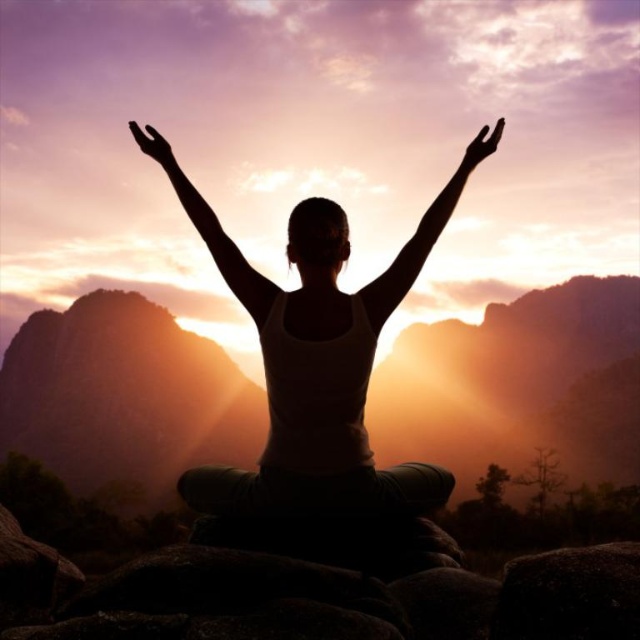
Is matte brown rock at center wider than silhouette yoga pose at center?

Yes.

Does matte brown rock at center have a lesser width compared to silhouette yoga pose at center?

No, matte brown rock at center is not thinner than silhouette yoga pose at center.

Where is `matte brown rock at center`? This screenshot has height=640, width=640. matte brown rock at center is located at coordinates (515, 385).

Is silhouette yoga pose at center behind silhouette arm at center?

No, it is in front of silhouette arm at center.

Is silhouette yoga pose at center above silhouette arm at center?

Actually, silhouette yoga pose at center is below silhouette arm at center.

Who is more forward, (248,516) or (179,170)?

Positioned in front is point (248,516).

Where is `silhouette yoga pose at center`? Image resolution: width=640 pixels, height=640 pixels. silhouette yoga pose at center is located at coordinates click(x=316, y=371).

Does silhouette yoga pose at center have a greater width compared to transparent glass hand at upper left?

Indeed, silhouette yoga pose at center has a greater width compared to transparent glass hand at upper left.

Between silhouette yoga pose at center and transparent glass hand at upper left, which one appears on the right side from the viewer's perspective?

From the viewer's perspective, silhouette yoga pose at center appears more on the right side.

This screenshot has width=640, height=640. I want to click on silhouette yoga pose at center, so click(x=316, y=371).

Locate an element on the screen. silhouette yoga pose at center is located at coordinates (316, 371).